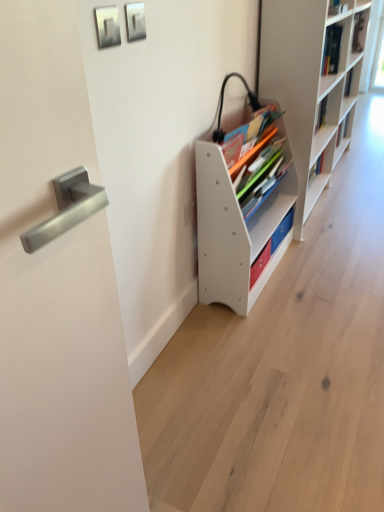
Question: Is satin silver handle at left oriented towards matte white bookshelf at center?

Choices:
 (A) yes
 (B) no

Answer: (B)

Question: Does satin silver handle at left have a smaller size compared to matte white bookshelf at center?

Choices:
 (A) no
 (B) yes

Answer: (A)

Question: Would you say satin silver handle at left contains matte white bookshelf at center?

Choices:
 (A) no
 (B) yes

Answer: (A)

Question: Considering the relative sizes of satin silver handle at left and matte white bookshelf at center in the image provided, is satin silver handle at left bigger than matte white bookshelf at center?

Choices:
 (A) no
 (B) yes

Answer: (B)

Question: Does satin silver handle at left lie behind matte white bookshelf at center?

Choices:
 (A) no
 (B) yes

Answer: (A)

Question: Visually, is metallic silver picture frame at upper center, placed as the 2th picture frame when sorted from left to right, positioned to the left or to the right of matte white bookshelf at center?

Choices:
 (A) right
 (B) left

Answer: (B)

Question: Which is correct: metallic silver picture frame at upper center, placed as the 2th picture frame when sorted from left to right, is inside matte white bookshelf at center, or outside of it?

Choices:
 (A) inside
 (B) outside

Answer: (B)

Question: Is metallic silver picture frame at upper center, which is counted as the 1th picture frame, starting from the right, in front of or behind matte white bookshelf at center in the image?

Choices:
 (A) behind
 (B) front

Answer: (B)

Question: In terms of width, does metallic silver picture frame at upper center, placed as the 2th picture frame when sorted from left to right, look wider or thinner when compared to matte white bookshelf at center?

Choices:
 (A) wide
 (B) thin

Answer: (B)

Question: Looking at the image, does matte white bookshelf at center seem bigger or smaller compared to satin silver handle at left?

Choices:
 (A) big
 (B) small

Answer: (B)

Question: From a real-world perspective, is matte white bookshelf at center positioned above or below satin silver handle at left?

Choices:
 (A) below
 (B) above

Answer: (A)

Question: Visually, is matte white bookshelf at center positioned to the left or to the right of satin silver handle at left?

Choices:
 (A) left
 (B) right

Answer: (B)

Question: Relative to satin silver handle at left, is matte white bookshelf at center in front or behind?

Choices:
 (A) behind
 (B) front

Answer: (A)

Question: From a real-world perspective, relative to white matte bookshelf at right, placed as the 1th shelf when sorted from right to left, is white plastic shelf at center, marked as the 2th shelf in a right-to-left arrangement, vertically above or below?

Choices:
 (A) below
 (B) above

Answer: (A)

Question: Considering the positions of white plastic shelf at center, the 1th shelf viewed from the left, and white matte bookshelf at right, placed as the 1th shelf when sorted from right to left, in the image, is white plastic shelf at center, the 1th shelf viewed from the left, bigger or smaller than white matte bookshelf at right, placed as the 1th shelf when sorted from right to left,?

Choices:
 (A) small
 (B) big

Answer: (A)